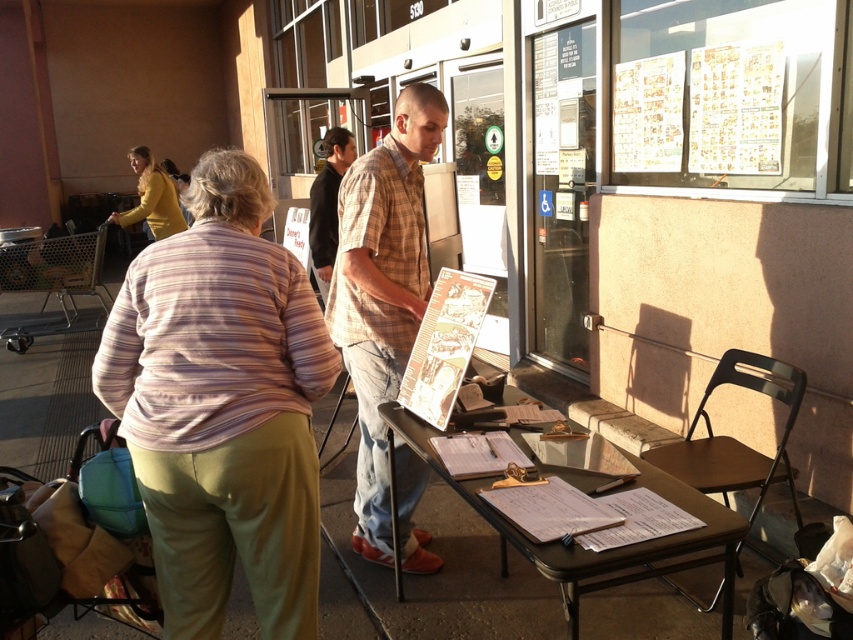
Can you confirm if plaid cotton shirt at center is bigger than metallic brown clipboard at center?

No.

This screenshot has width=853, height=640. Describe the element at coordinates (381, 291) in the screenshot. I see `plaid cotton shirt at center` at that location.

Find the location of a particular element. Image resolution: width=853 pixels, height=640 pixels. plaid cotton shirt at center is located at coordinates (381, 291).

Who is positioned more to the right, striped cotton shirt at left or plaid shirt at center?

striped cotton shirt at left is more to the right.

Is striped cotton shirt at left above plaid shirt at center?

Incorrect, striped cotton shirt at left is not positioned above plaid shirt at center.

What do you see at coordinates (222, 406) in the screenshot? I see `striped cotton shirt at left` at bounding box center [222, 406].

At what (x,y) coordinates should I click in order to perform the action: click on striped cotton shirt at left. Please return your answer as a coordinate pair (x, y). The height and width of the screenshot is (640, 853). Looking at the image, I should click on (222, 406).

Does metallic brown clipboard at center appear on the right side of matte yellow sweater at upper left?

Yes, metallic brown clipboard at center is to the right of matte yellow sweater at upper left.

Can you confirm if metallic brown clipboard at center is positioned above matte yellow sweater at upper left?

Actually, metallic brown clipboard at center is below matte yellow sweater at upper left.

Who is more distant from viewer, (x=576, y=600) or (x=144, y=150)?

The point (x=144, y=150) is more distant.

Locate an element on the screen. This screenshot has width=853, height=640. metallic brown clipboard at center is located at coordinates (602, 550).